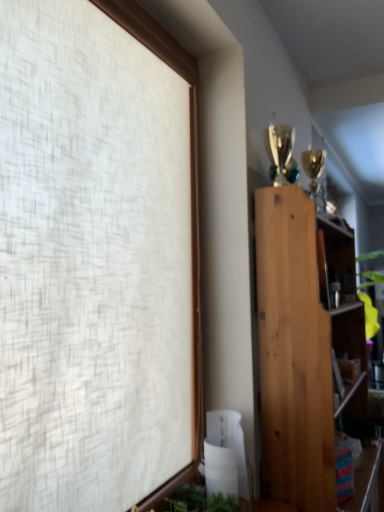
Question: Can green leafy plant at bottom be found inside natural wood bookcase at right?

Choices:
 (A) yes
 (B) no

Answer: (B)

Question: Is the depth of natural wood bookcase at right less than that of green leafy plant at bottom?

Choices:
 (A) yes
 (B) no

Answer: (B)

Question: Is natural wood bookcase at right oriented towards green leafy plant at bottom?

Choices:
 (A) no
 (B) yes

Answer: (A)

Question: From a real-world perspective, is natural wood bookcase at right physically below green leafy plant at bottom?

Choices:
 (A) yes
 (B) no

Answer: (B)

Question: Is natural wood bookcase at right wider than green leafy plant at bottom?

Choices:
 (A) no
 (B) yes

Answer: (B)

Question: Considering the relative positions of natural wood bookcase at right and green leafy plant at bottom in the image provided, is natural wood bookcase at right to the left of green leafy plant at bottom from the viewer's perspective?

Choices:
 (A) yes
 (B) no

Answer: (B)

Question: From the image's perspective, does green leafy plant at bottom appear higher than natural wood bookcase at right?

Choices:
 (A) yes
 (B) no

Answer: (B)

Question: From a real-world perspective, is green leafy plant at bottom on natural wood bookcase at right?

Choices:
 (A) yes
 (B) no

Answer: (B)

Question: Considering the relative positions of green leafy plant at bottom and natural wood bookcase at right in the image provided, is green leafy plant at bottom behind natural wood bookcase at right?

Choices:
 (A) no
 (B) yes

Answer: (A)

Question: Is green leafy plant at bottom taller than natural wood bookcase at right?

Choices:
 (A) yes
 (B) no

Answer: (B)

Question: Is green leafy plant at bottom to the right of natural wood bookcase at right from the viewer's perspective?

Choices:
 (A) yes
 (B) no

Answer: (B)

Question: Is green leafy plant at bottom surrounding natural wood bookcase at right?

Choices:
 (A) yes
 (B) no

Answer: (B)

Question: Is green leafy plant at bottom wider or thinner than natural wood bookcase at right?

Choices:
 (A) thin
 (B) wide

Answer: (A)